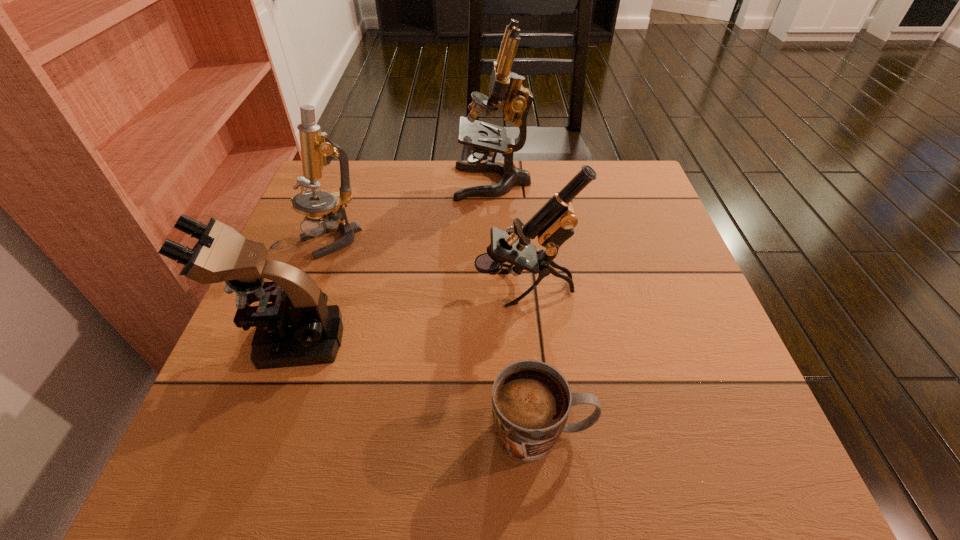
I want to click on vacant area at the left edge of the desktop, so click(x=333, y=294).

Where is `vacant space at the right edge`? This screenshot has height=540, width=960. vacant space at the right edge is located at coordinates (683, 348).

Find the location of `vacant position at the far right corner of the desktop`. vacant position at the far right corner of the desktop is located at coordinates (610, 177).

In the image, there is a desktop. At what (x,y) coordinates should I click in order to perform the action: click on vacant space at the near right corner. Please return your answer as a coordinate pair (x, y). Looking at the image, I should click on (709, 469).

The width and height of the screenshot is (960, 540). Find the location of `free point between the nearest microscope and the shortest object`. free point between the nearest microscope and the shortest object is located at coordinates (416, 386).

Locate an element on the screen. vacant area that lies between the tallest microscope and the mug is located at coordinates (516, 308).

This screenshot has width=960, height=540. I want to click on free spot between the nearest microscope and the third farthest microscope, so click(407, 314).

This screenshot has width=960, height=540. What are the coordinates of `empty space between the tallest microscope and the second farthest microscope` in the screenshot? It's located at (412, 212).

The width and height of the screenshot is (960, 540). Find the location of `free area in between the farthest object and the nearest object`. free area in between the farthest object and the nearest object is located at coordinates (x=516, y=308).

The width and height of the screenshot is (960, 540). Find the location of `empty space between the farthest object and the fourth nearest object`. empty space between the farthest object and the fourth nearest object is located at coordinates (412, 212).